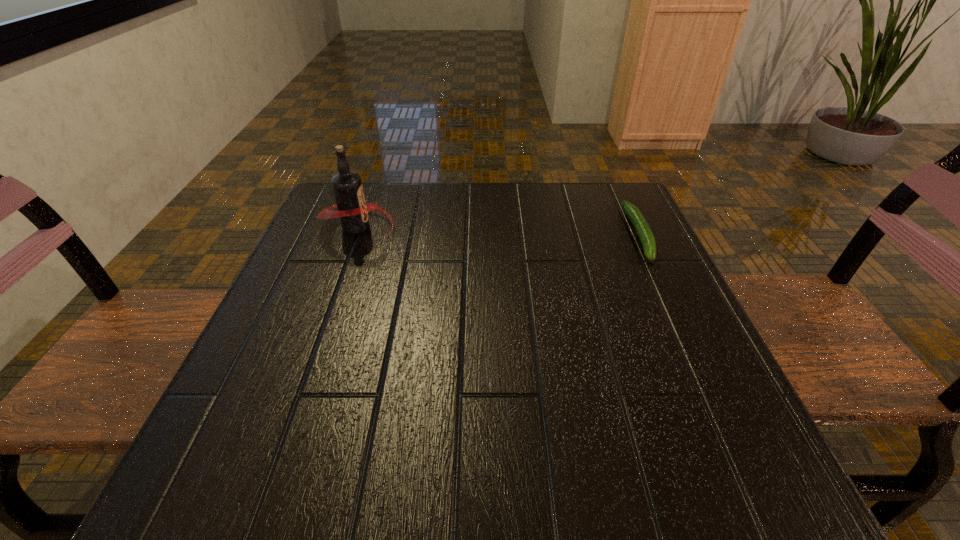
The image size is (960, 540). I want to click on object that is at the far left corner, so click(353, 211).

You are a GUI agent. You are given a task and a screenshot of the screen. Output one action in this format:
    pyautogui.click(x=<x>, y=<y>)
    Task: Click on the object situated at the far right corner
    
    Given the screenshot: What is the action you would take?
    pyautogui.click(x=647, y=239)

Locate an element on the screen. The width and height of the screenshot is (960, 540). vacant space at the far edge of the desktop is located at coordinates (422, 202).

I want to click on vacant area at the near edge of the desktop, so click(564, 434).

Image resolution: width=960 pixels, height=540 pixels. I want to click on free space at the left edge, so click(280, 346).

Where is `free point at the right edge`? The image size is (960, 540). free point at the right edge is located at coordinates (732, 419).

Identify the location of free region at the far left corner of the desktop. The width and height of the screenshot is (960, 540). (324, 204).

At what (x,y) coordinates should I click in order to perform the action: click on free space at the far right corner of the desktop. Please return your answer as a coordinate pair (x, y). This screenshot has width=960, height=540. Looking at the image, I should click on (587, 188).